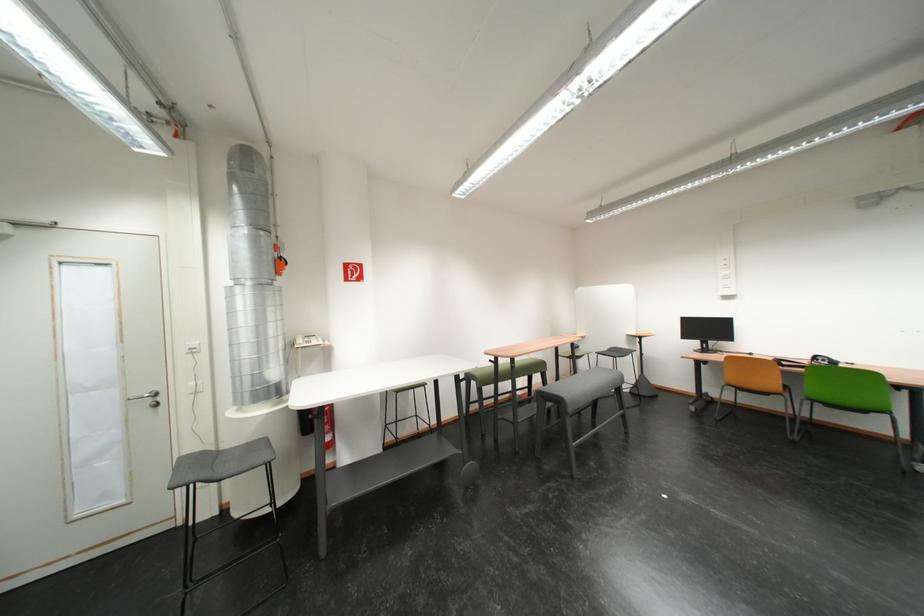
The image size is (924, 616). Identify the location of black stool sitting surface. (578, 391).